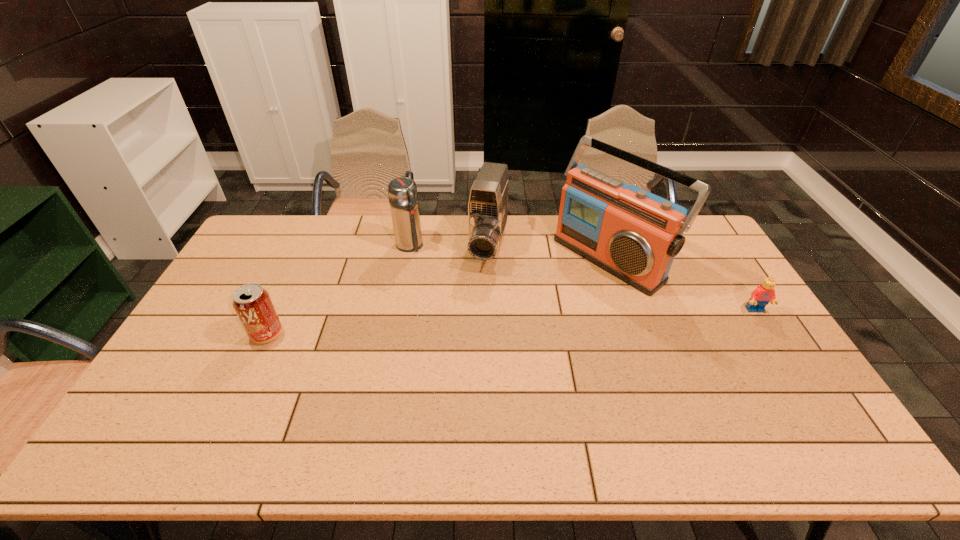
The width and height of the screenshot is (960, 540). I want to click on free spot between the shortest object and the second shortest object, so click(511, 322).

In order to click on vacant area between the third object from right to left and the second shortest object in this screenshot , I will do `click(377, 290)`.

At what (x,y) coordinates should I click in order to perform the action: click on vacant space that's between the thermos bottle and the third object from right to left. Please return your answer as a coordinate pair (x, y). This screenshot has width=960, height=540. Looking at the image, I should click on (x=449, y=246).

Locate an element on the screen. This screenshot has height=540, width=960. vacant space that's between the camcorder and the thermos bottle is located at coordinates (449, 246).

Locate an element on the screen. The image size is (960, 540). free space between the leftmost object and the shortest object is located at coordinates (511, 322).

The image size is (960, 540). Identify the location of empty location between the Lego and the second object from left to right. (583, 278).

This screenshot has width=960, height=540. I want to click on object that is the nearest to the camcorder, so click(x=402, y=192).

Locate an element on the screen. The image size is (960, 540). object identified as the third closest to the thermos bottle is located at coordinates (633, 234).

Identify the location of free space that satisfies the following two spatial constraints: 1. on the back side of the thermos bottle; 2. on the left side of the fourth tallest object. Image resolution: width=960 pixels, height=540 pixels. (308, 246).

In order to click on vacant area in the image that satisfies the following two spatial constraints: 1. on the back side of the nearest object; 2. on the right side of the fourth object from left to right in this screenshot , I will do `click(302, 258)`.